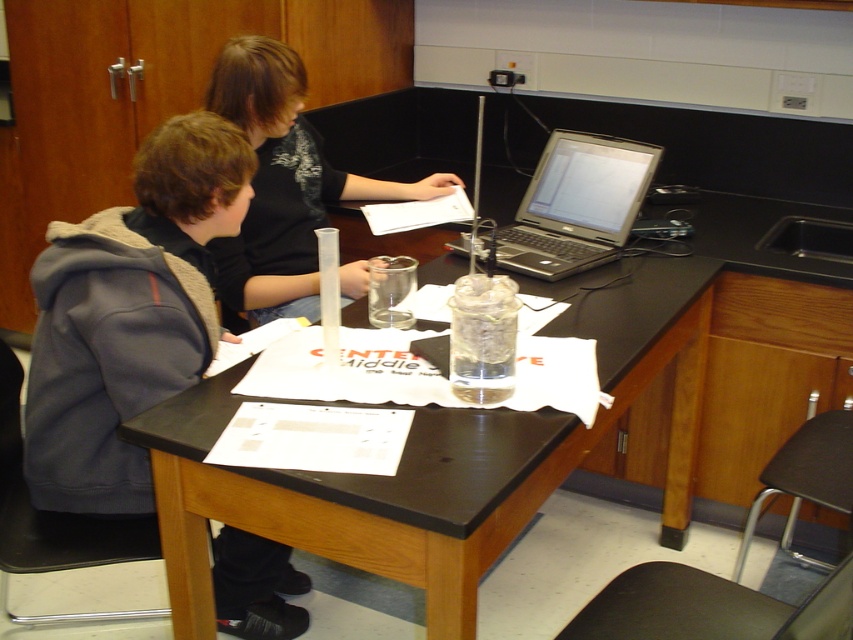
You are standing in the laboratory and need to hand a document to the person wearing the gray fleece hoodie at left. The document must be placed on the silver metallic laptop at center. Can you reach the laptop from your current position without moving the hoodie?

The gray fleece hoodie at left is closer to the viewer than the silver metallic laptop at center, so yes, you can reach the silver metallic laptop at center from your current position without moving the hoodie as it is further away.

You are a researcher in the lab. You need to pass a tool from the person wearing a gray hoodie on the left to the person wearing the black matte shirt at center. What is the minimum distance you need to cover to hand the tool directly between them?

The minimum distance you need to cover to hand the tool directly between them is 0.935 meters, which is half of their 1.87 meters apart distance.

You are a student in the laboratory and need to place a 12 inch ruler between the black matte shirt at center and the silver metallic laptop at center. Will there be enough space?

The black matte shirt at center is 17.83 inches away from the silver metallic laptop at center. Since the ruler is 12 inches long, there is sufficient space to place it between them.